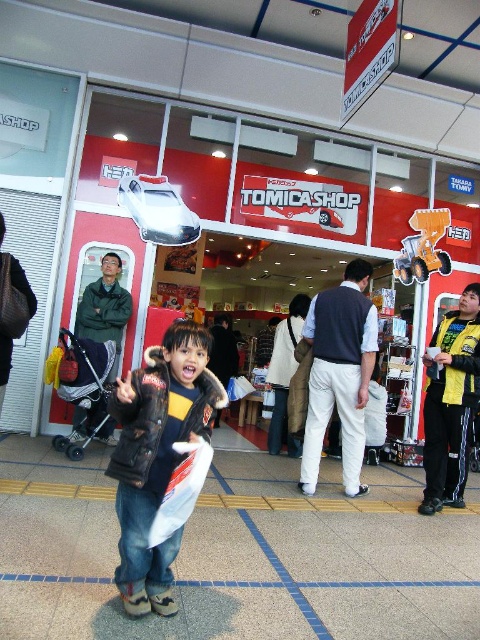
Question: Which is nearer to the white cotton pants at center?

Choices:
 (A) dark brown leather jacket at center
 (B) yellow plastic construction vehicle at center

Answer: (A)

Question: Among these points, which one is farthest from the camera?

Choices:
 (A) (359, 332)
 (B) (421, 266)

Answer: (B)

Question: Which of the following is the closest to the observer?

Choices:
 (A) white cotton pants at center
 (B) yellow plastic construction vehicle at center
 (C) dark brown leather jacket at center

Answer: (C)

Question: Is white cotton pants at center to the right of yellow plastic construction vehicle at center from the viewer's perspective?

Choices:
 (A) no
 (B) yes

Answer: (A)

Question: Is dark brown leather jacket at center smaller than yellow plastic construction vehicle at center?

Choices:
 (A) yes
 (B) no

Answer: (B)

Question: Can you confirm if white cotton pants at center is wider than yellow plastic construction vehicle at center?

Choices:
 (A) yes
 (B) no

Answer: (B)